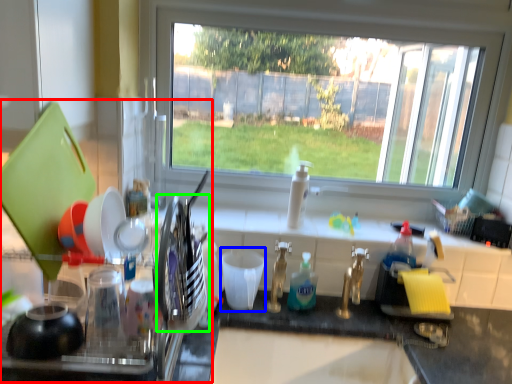
Question: Considering the real-world distances, which object is farthest from appliance (highlighted by a red box)? tableware (highlighted by a blue box) or tableware (highlighted by a green box)?

Choices:
 (A) tableware
 (B) tableware

Answer: (A)